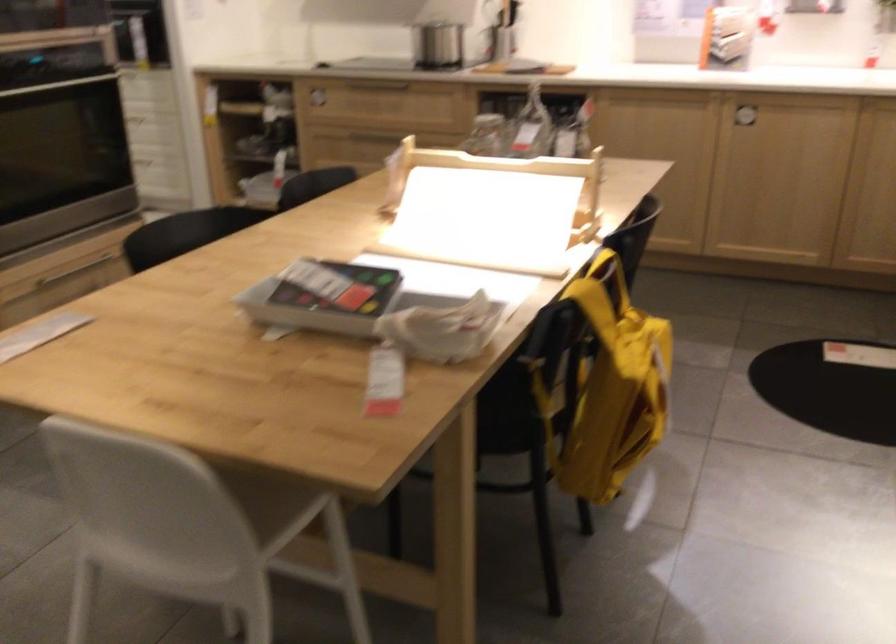
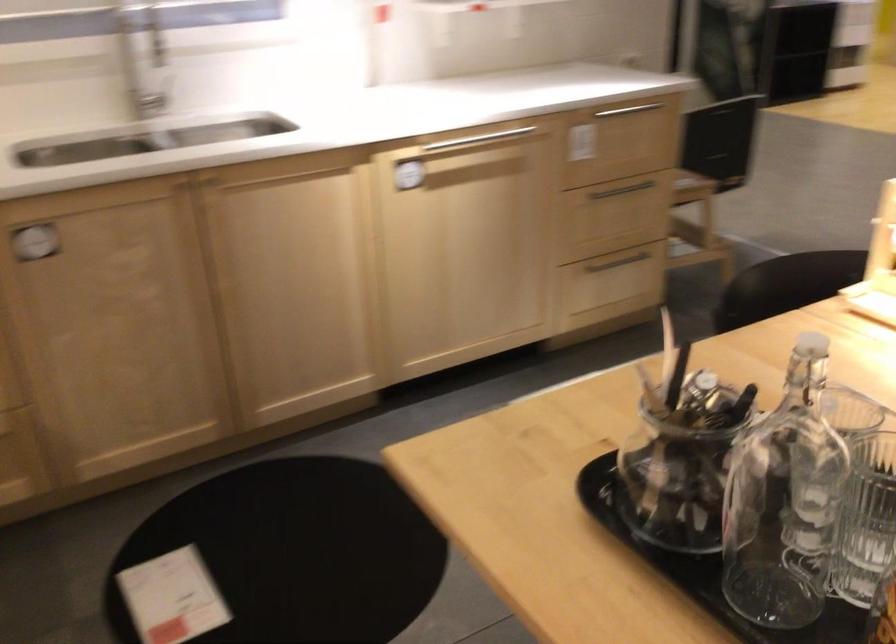
Question: I am providing you with two images of the same scene from different viewpoints. After the viewpoint changes to image2, which objects are now occluded?

Choices:
 (A) black chair sitting surface
 (B) bottle stopper
 (C) black and white bag
 (D) silver cabinet handle

Answer: (A)